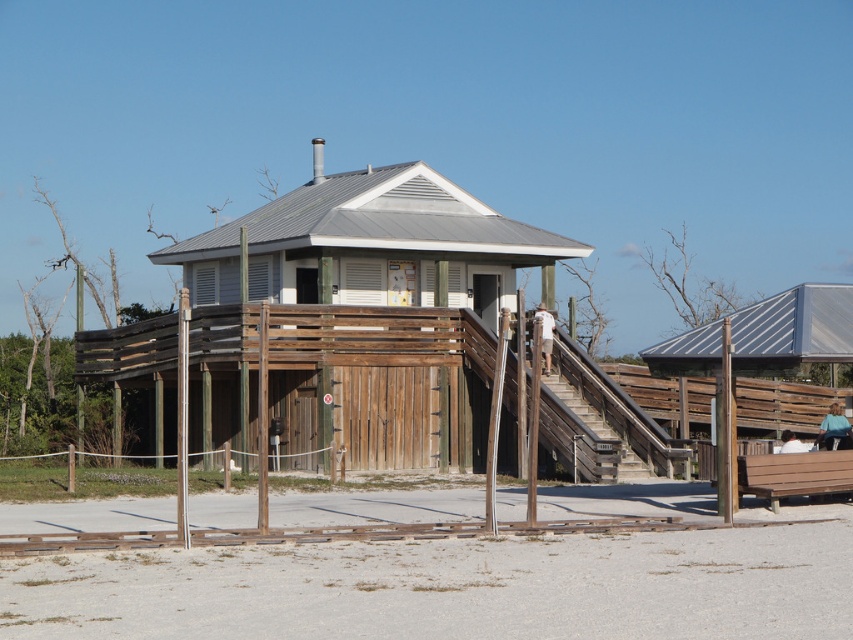
Question: Which object is farther from the camera taking this photo?

Choices:
 (A) light blue shirt at lower right
 (B) metallic gray bench at right
 (C) white cotton shorts at center
 (D) blue denim shirt at lower right

Answer: (D)

Question: Is white sandy beach at lower center further to camera compared to light blue shirt at lower right?

Choices:
 (A) no
 (B) yes

Answer: (A)

Question: Which of the following is the closest to the observer?

Choices:
 (A) (804, 451)
 (B) (828, 440)

Answer: (A)

Question: Among these objects, which one is farthest from the camera?

Choices:
 (A) metallic gray bench at right
 (B) white sandy beach at lower center
 (C) light blue shirt at lower right

Answer: (C)

Question: Does metallic gray bench at right appear on the left side of blue denim shirt at lower right?

Choices:
 (A) yes
 (B) no

Answer: (A)

Question: Is blue denim shirt at lower right positioned behind light blue shirt at lower right?

Choices:
 (A) no
 (B) yes

Answer: (B)